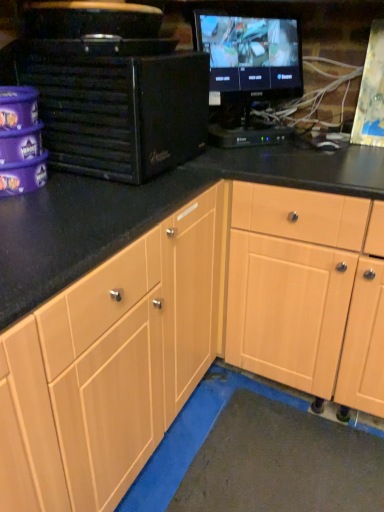
What do you see at coordinates (305, 294) in the screenshot? The height and width of the screenshot is (512, 384). I see `light wood cabinet at center` at bounding box center [305, 294].

This screenshot has width=384, height=512. What do you see at coordinates (114, 106) in the screenshot?
I see `black matte desktop computer at left` at bounding box center [114, 106].

What are the coordinates of `black glossy monitor at upper right` in the screenshot? It's located at (248, 74).

Which is closer, (234, 301) or (182, 130)?

The point (182, 130) is more forward.

Based on the photo, from the image's perspective, is light wood cabinet at center positioned above or below black matte desktop computer at left?

light wood cabinet at center is situated lower than black matte desktop computer at left in the image.

Is light wood cabinet at center positioned with its back to black matte desktop computer at left?

That's not correct — light wood cabinet at center is not looking away from black matte desktop computer at left.

Considering the points (201, 18) and (235, 264), which point is in front, point (201, 18) or point (235, 264)?

The point (235, 264) is closer to the camera.

From a real-world perspective, is black glossy monitor at upper right positioned under light wood cabinet at center based on gravity?

No, from a real-world perspective, black glossy monitor at upper right is not beneath light wood cabinet at center.

How distant is black glossy monitor at upper right from light wood cabinet at center?

black glossy monitor at upper right is 21.95 inches away from light wood cabinet at center.

Does black glossy monitor at upper right have a lesser width compared to light wood cabinet at center?

Correct, the width of black glossy monitor at upper right is less than that of light wood cabinet at center.

From a real-world perspective, is light wood cabinet at center above or below black glossy monitor at upper right?

light wood cabinet at center is below black glossy monitor at upper right.

Based on the photo, considering the relative sizes of light wood cabinet at center and black glossy monitor at upper right in the image provided, is light wood cabinet at center wider than black glossy monitor at upper right?

Yes, light wood cabinet at center is wider than black glossy monitor at upper right.

Is black glossy monitor at upper right surrounded by light wood cabinet at center?

No, black glossy monitor at upper right is located outside of light wood cabinet at center.

Consider the image. Does black matte desktop computer at left have a lesser height compared to light wood cabinet at center?

Yes, black matte desktop computer at left is shorter than light wood cabinet at center.

Image resolution: width=384 pixels, height=512 pixels. There is a light wood cabinet at center. In order to click on desktop computer above it (from a real-world perspective) in this screenshot , I will do `click(114, 106)`.

From a real-world perspective, relative to light wood cabinet at center, is black matte desktop computer at left vertically above or below?

In terms of real-world spatial position, black matte desktop computer at left is above light wood cabinet at center.

Can you confirm if black matte desktop computer at left is wider than black glossy monitor at upper right?

Yes.

From the image's perspective, is black matte desktop computer at left on black glossy monitor at upper right?

No.

Is black matte desktop computer at left not within black glossy monitor at upper right?

Yes, black matte desktop computer at left is not within black glossy monitor at upper right.

Is black glossy monitor at upper right taller than black matte desktop computer at left?

Correct, black glossy monitor at upper right is much taller as black matte desktop computer at left.

Considering the sizes of objects black glossy monitor at upper right and black matte desktop computer at left in the image provided, who is bigger, black glossy monitor at upper right or black matte desktop computer at left?

black matte desktop computer at left.

Which is more to the right, black glossy monitor at upper right or black matte desktop computer at left?

black glossy monitor at upper right.

Where is `desktop computer to the left of light wood cabinet at center`? desktop computer to the left of light wood cabinet at center is located at coordinates (114, 106).

Where is `cabinetry directly beneath the black glossy monitor at upper right (from a real-world perspective)`? The width and height of the screenshot is (384, 512). cabinetry directly beneath the black glossy monitor at upper right (from a real-world perspective) is located at coordinates (305, 294).

Which object lies further to the anchor point black matte desktop computer at left, black glossy monitor at upper right or light wood cabinet at center?

light wood cabinet at center is positioned further to the anchor black matte desktop computer at left.

When comparing their distances from light wood cabinet at center, does black glossy monitor at upper right or black matte desktop computer at left seem closer?

The object closer to light wood cabinet at center is black matte desktop computer at left.

When comparing their distances from black matte desktop computer at left, does light wood cabinet at center or black glossy monitor at upper right seem closer?

black glossy monitor at upper right lies closer to black matte desktop computer at left than the other object.

Consider the image. Considering their positions, is light wood cabinet at center positioned closer to black glossy monitor at upper right than black matte desktop computer at left?

black matte desktop computer at left.

Looking at this image, looking at the image, which one is located further to light wood cabinet at center, black matte desktop computer at left or black glossy monitor at upper right?

The object further to light wood cabinet at center is black glossy monitor at upper right.

When comparing their distances from black glossy monitor at upper right, does black matte desktop computer at left or light wood cabinet at center seem closer?

black matte desktop computer at left.

You are a GUI agent. You are given a task and a screenshot of the screen. Output one action in this format:
    pyautogui.click(x=<x>, y=<y>)
    Task: Click on the desktop computer that lies between black glossy monitor at upper right and light wood cabinet at center from top to bottom
    The height and width of the screenshot is (512, 384).
    Given the screenshot: What is the action you would take?
    pyautogui.click(x=114, y=106)